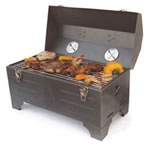
You are a GUI agent. You are given a task and a screenshot of the screen. Output one action in this format:
    pyautogui.click(x=<x>, y=<y>)
    Task: Click on the front right table leg
    This screenshot has height=147, width=150.
    Given the screenshot: What is the action you would take?
    pyautogui.click(x=99, y=133)